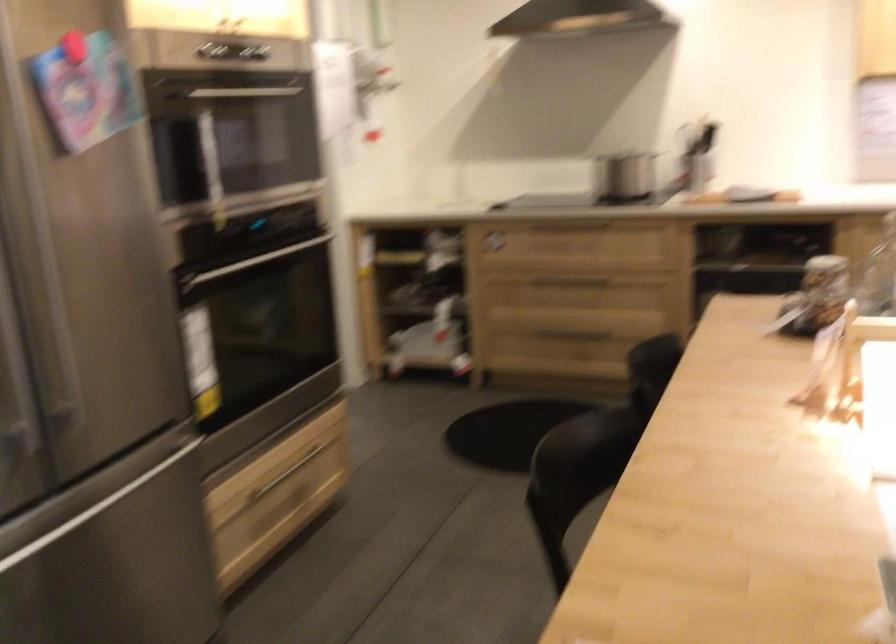
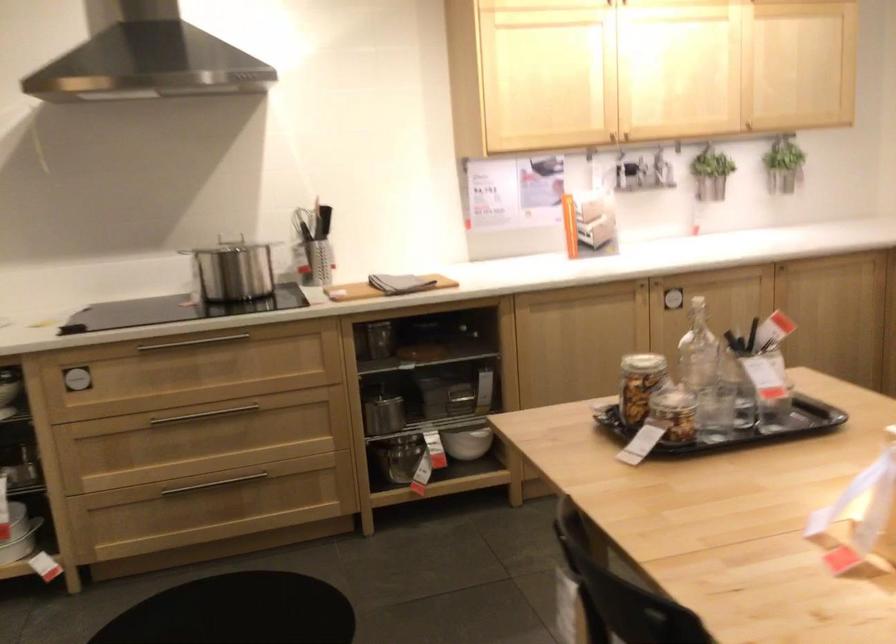
Find the pixel in the second image that matches point (695, 147) in the first image.

(313, 245)